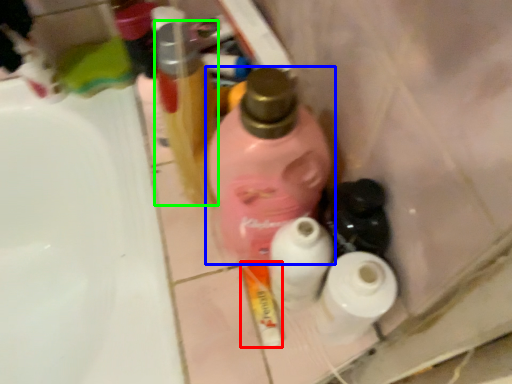
Question: Which object is the farthest from toothpaste (highlighted by a red box)? Choose among these: bottle (highlighted by a blue box) or bottle (highlighted by a green box).

Choices:
 (A) bottle
 (B) bottle

Answer: (B)